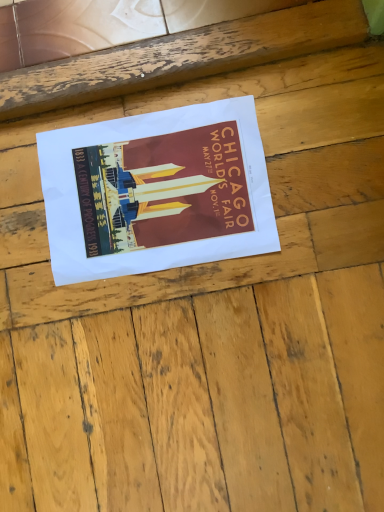
Identify the location of vacant area on top of wooden at center (from a real-world perspective). Image resolution: width=384 pixels, height=512 pixels. click(x=211, y=273).